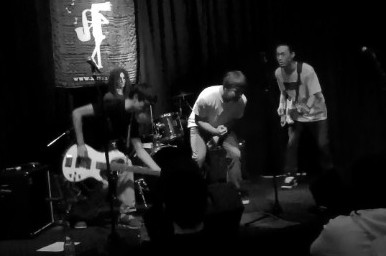
I want to click on curtains black, so click(160, 35).